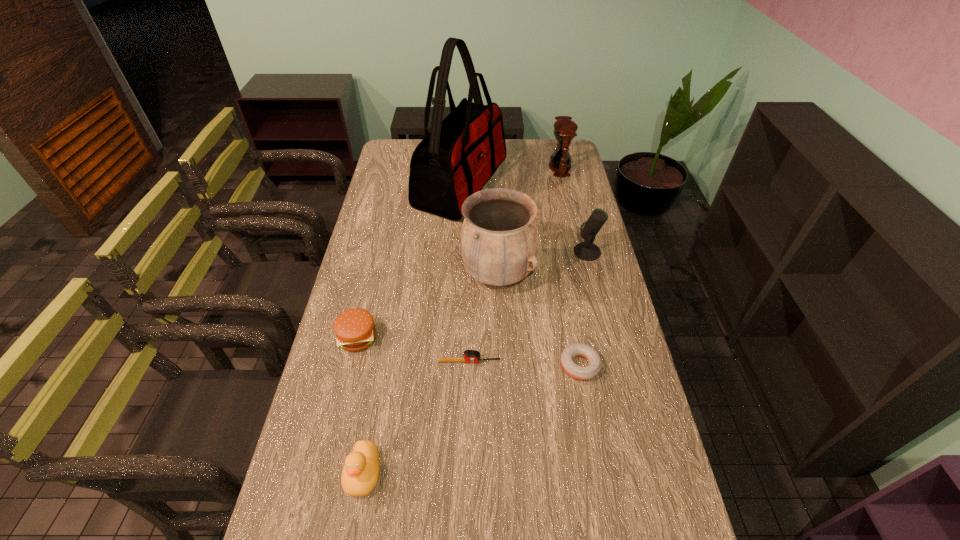
Where is `vacant space that satisfies the following two spatial constraints: 1. on the back side of the hourglass; 2. on the right side of the urn`? The height and width of the screenshot is (540, 960). vacant space that satisfies the following two spatial constraints: 1. on the back side of the hourglass; 2. on the right side of the urn is located at coordinates pos(493,167).

This screenshot has width=960, height=540. Identify the location of vacant area in the image that satisfies the following two spatial constraints: 1. on the front side of the tape measure; 2. on the right side of the doughnut. (469, 365).

Where is `free space that satisfies the following two spatial constraints: 1. on the back side of the seventh shortest object; 2. on the left side of the tape measure`? free space that satisfies the following two spatial constraints: 1. on the back side of the seventh shortest object; 2. on the left side of the tape measure is located at coordinates (471, 276).